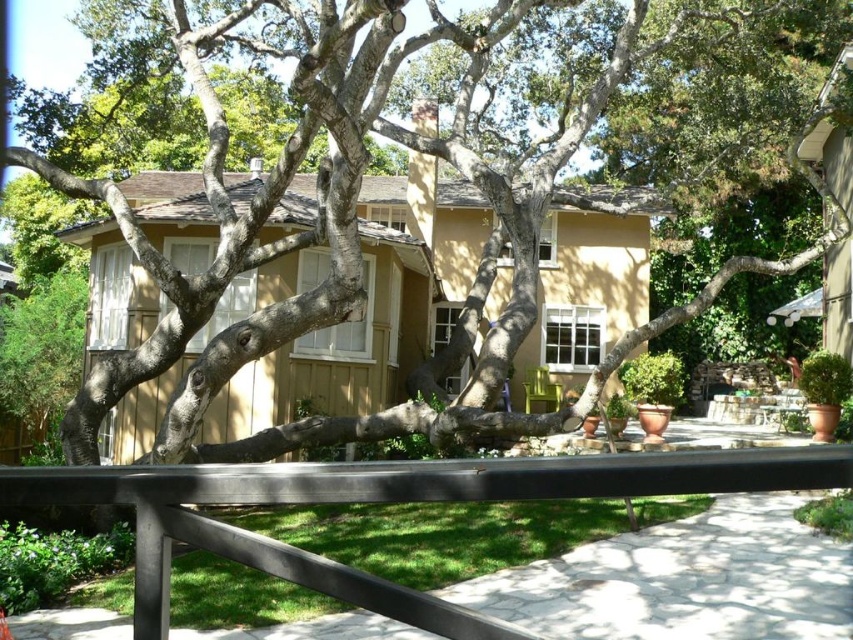
Question: Is brown textured tree at center above black metal rail at center?

Choices:
 (A) yes
 (B) no

Answer: (A)

Question: Is brown textured tree at center positioned behind black metal rail at center?

Choices:
 (A) yes
 (B) no

Answer: (A)

Question: Among these points, which one is farthest from the camera?

Choices:
 (A) (405, 426)
 (B) (778, 474)

Answer: (A)

Question: Is the position of brown textured tree at center more distant than that of black metal rail at center?

Choices:
 (A) yes
 (B) no

Answer: (A)